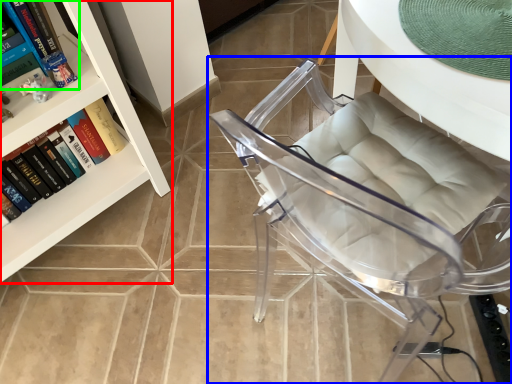
Question: Which is nearer to the bookcase (highlighted by a red box)? chair (highlighted by a blue box) or book (highlighted by a green box).

Choices:
 (A) chair
 (B) book

Answer: (B)